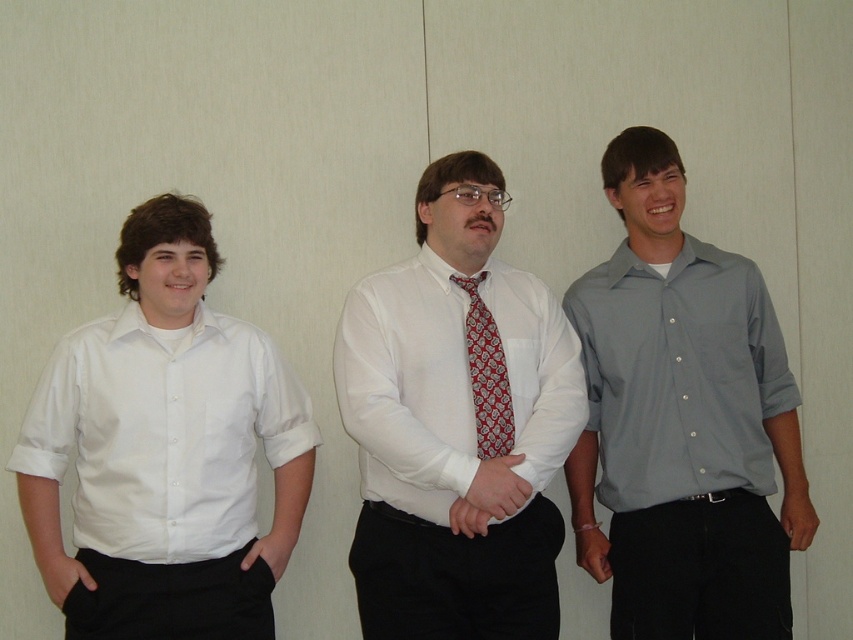
Question: Estimate the real-world distances between objects in this image. Which object is closer to the white cotton shirt at left?

Choices:
 (A) light gray button-down shirt at right
 (B) white glossy shirt at center
 (C) red patterned tie at center

Answer: (B)

Question: Which object is the farthest from the light gray button-down shirt at right?

Choices:
 (A) white glossy shirt at center
 (B) white cotton shirt at left

Answer: (B)

Question: Does light gray button-down shirt at right have a greater width compared to white cotton shirt at left?

Choices:
 (A) no
 (B) yes

Answer: (A)

Question: Is light gray button-down shirt at right above white cotton shirt at left?

Choices:
 (A) yes
 (B) no

Answer: (A)

Question: Among these points, which one is nearest to the camera?

Choices:
 (A) (485, 454)
 (B) (724, 304)
 (C) (405, 419)
 (D) (123, 376)

Answer: (C)

Question: Is the position of white glossy shirt at center more distant than that of white cotton shirt at left?

Choices:
 (A) no
 (B) yes

Answer: (A)